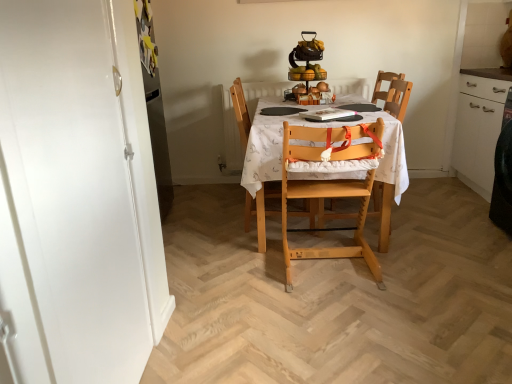
Locate an element on the screen. This screenshot has height=384, width=512. vacant point to the left of white printed fabric at center is located at coordinates (205, 218).